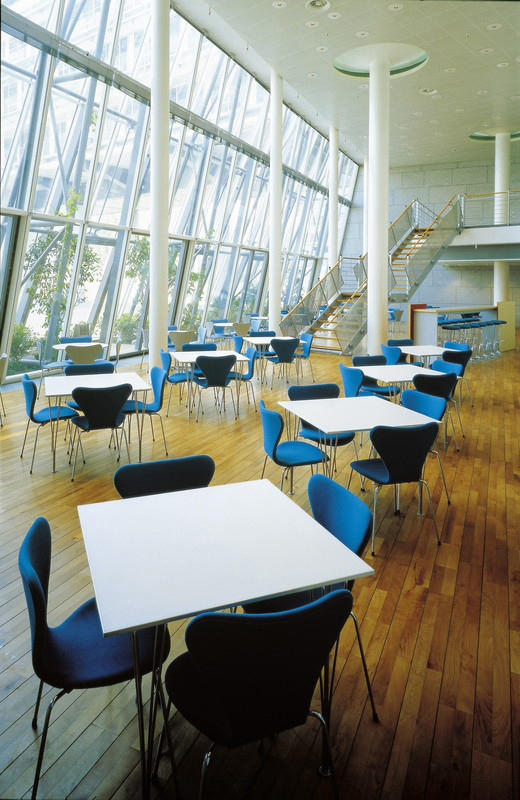
Identify the location of columns. This screenshot has height=800, width=520. (504, 176), (377, 194), (363, 217), (331, 213), (275, 229), (166, 248).